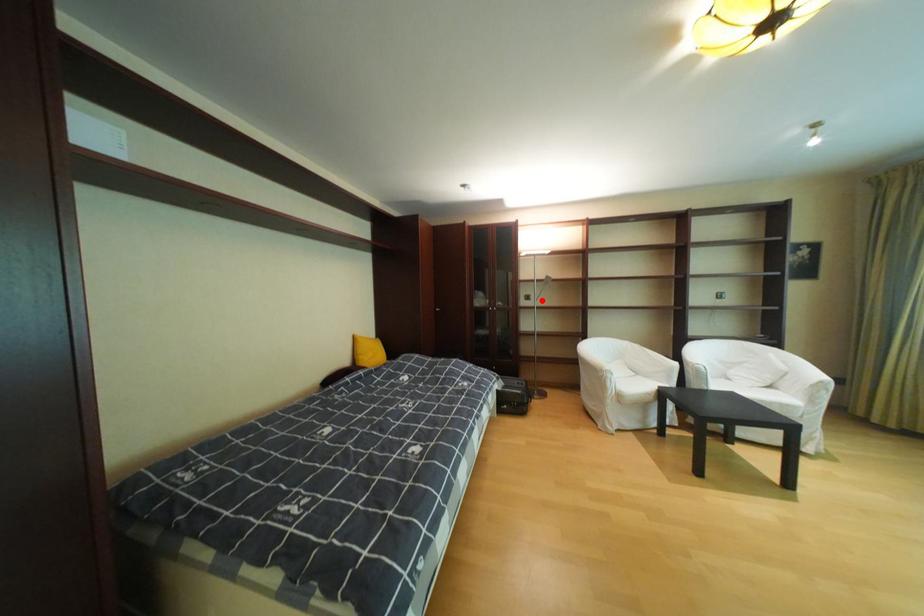
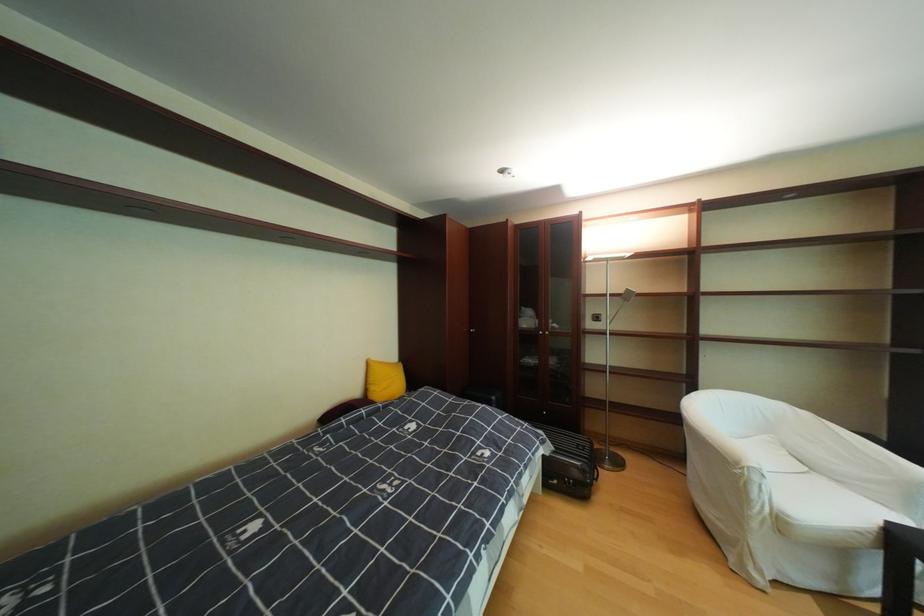
In the second image, find the point that corresponds to the highlighted location in the first image.

(612, 322)